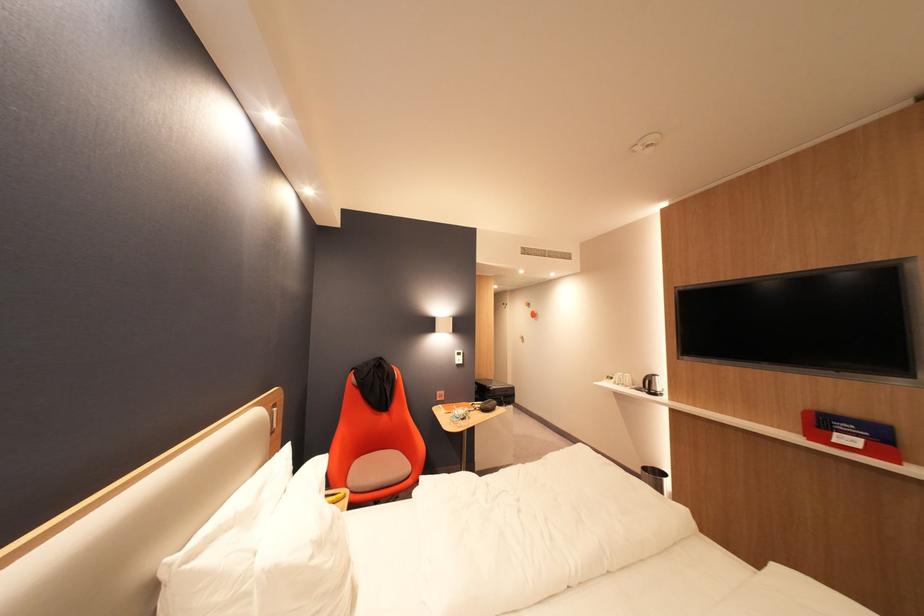
The image size is (924, 616). Describe the element at coordinates (653, 477) in the screenshot. I see `a silver trash can` at that location.